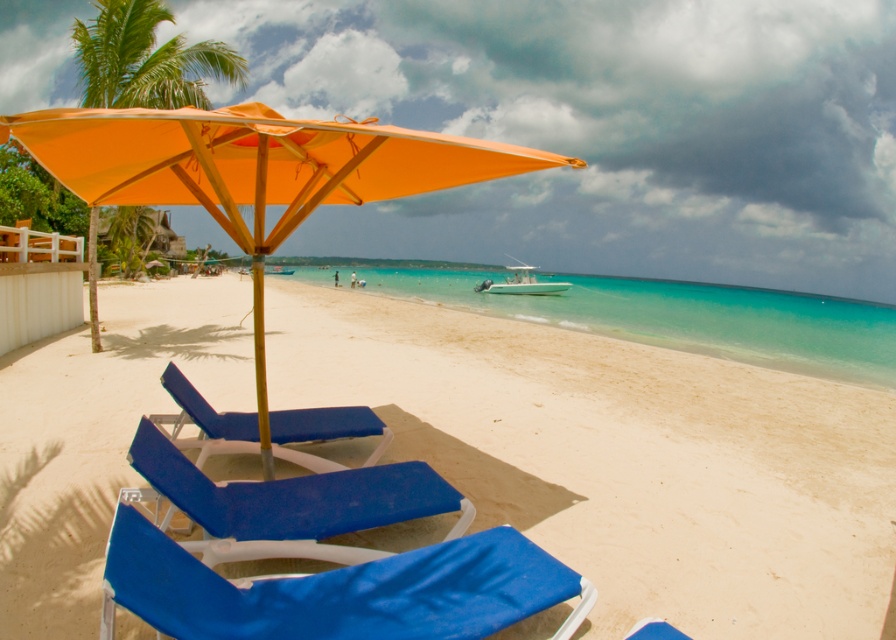
From the picture: Does orange fabric umbrella at center appear over blue fabric beach chair at lower left?

Correct, orange fabric umbrella at center is located above blue fabric beach chair at lower left.

Who is taller, orange fabric umbrella at center or blue fabric beach chair at lower left?

Standing taller between the two is orange fabric umbrella at center.

Image resolution: width=896 pixels, height=640 pixels. In order to click on orange fabric umbrella at center in this screenshot , I will do `click(254, 172)`.

Can you confirm if orange fabric umbrella at center is positioned below green leafy palm tree at upper left?

Indeed, orange fabric umbrella at center is positioned under green leafy palm tree at upper left.

What do you see at coordinates (254, 172) in the screenshot?
I see `orange fabric umbrella at center` at bounding box center [254, 172].

Locate an element on the screen. The width and height of the screenshot is (896, 640). orange fabric umbrella at center is located at coordinates (254, 172).

Is blue fabric beach chair at lower left taller than blue fabric beach chair at center?

Incorrect, blue fabric beach chair at lower left's height is not larger of blue fabric beach chair at center's.

Is point (420, 566) closer to camera compared to point (200, 429)?

Yes, it is.

Who is more distant from viewer, (x=125, y=499) or (x=377, y=435)?

The point (x=377, y=435) is more distant.

Locate an element on the screen. This screenshot has height=640, width=896. blue fabric beach chair at lower left is located at coordinates coord(338,589).